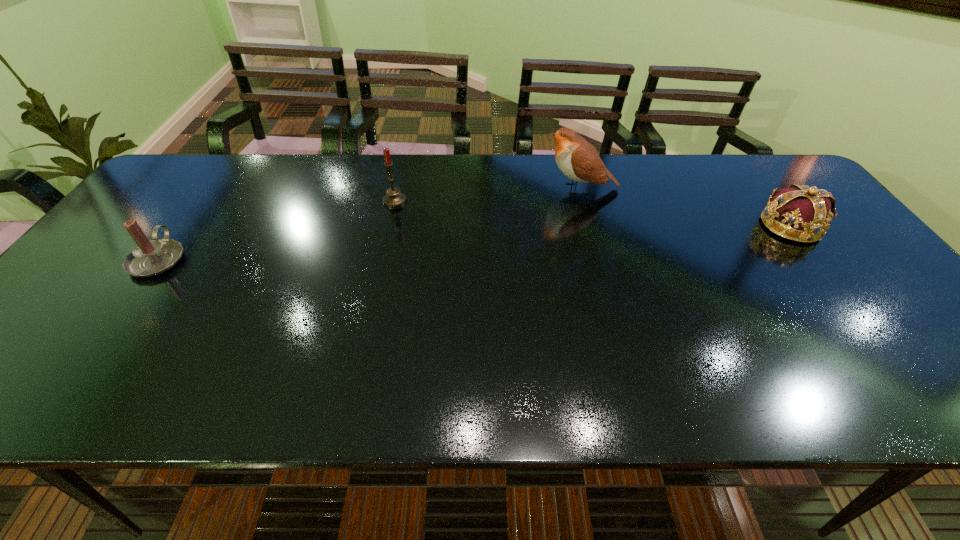
Where is `free space that satisfies the following two spatial constraints: 1. on the side of the farther candle with the handle loop; 2. on the right side of the shorter candle`? This screenshot has width=960, height=540. free space that satisfies the following two spatial constraints: 1. on the side of the farther candle with the handle loop; 2. on the right side of the shorter candle is located at coordinates (202, 200).

The image size is (960, 540). In order to click on free space that satisfies the following two spatial constraints: 1. on the side of the leftmost object with the handle loop; 2. on the right side of the crown in this screenshot , I will do `click(183, 226)`.

Identify the location of vacant position in the image that satisfies the following two spatial constraints: 1. on the side of the left candle with the handle loop; 2. on the left side of the second object from left to right. This screenshot has height=540, width=960. (202, 200).